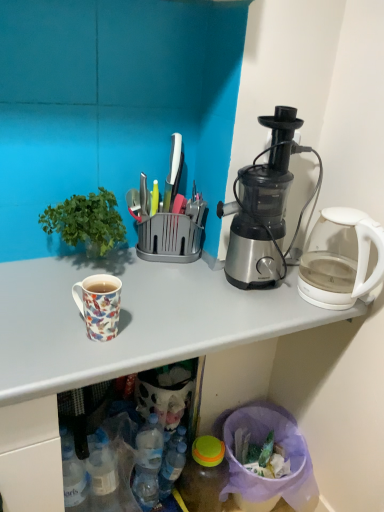
Locate an element on the screen. Image resolution: width=384 pixels, height=512 pixels. vacant space that is to the left of green leafy plant at left is located at coordinates (24, 274).